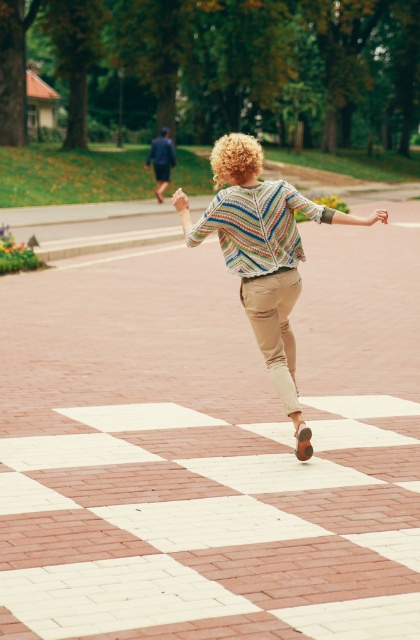
In the scene shown: Can you confirm if brick pavement at center is thinner than dark blue suit at upper left?

No.

Which is more to the left, brick pavement at center or dark blue suit at upper left?

dark blue suit at upper left is more to the left.

Where is `brick pavement at center`? This screenshot has width=420, height=640. brick pavement at center is located at coordinates (210, 448).

Based on the photo, which is more to the left, curly blonde hair at center or dark blue suit at upper left?

dark blue suit at upper left

Is the position of curly blonde hair at center more distant than that of dark blue suit at upper left?

No, curly blonde hair at center is closer to the viewer.

Does point (238, 160) come farther from viewer compared to point (160, 148)?

No, it is not.

The width and height of the screenshot is (420, 640). Identify the location of curly blonde hair at center. (236, 160).

Between brick pavement at center and multicolored knitted sweater at center, which one is positioned lower?

Positioned lower is brick pavement at center.

Can you confirm if brick pavement at center is shorter than multicolored knitted sweater at center?

In fact, brick pavement at center may be taller than multicolored knitted sweater at center.

What do you see at coordinates (210, 448) in the screenshot? I see `brick pavement at center` at bounding box center [210, 448].

Find the location of a particular element. This screenshot has width=420, height=640. brick pavement at center is located at coordinates (210, 448).